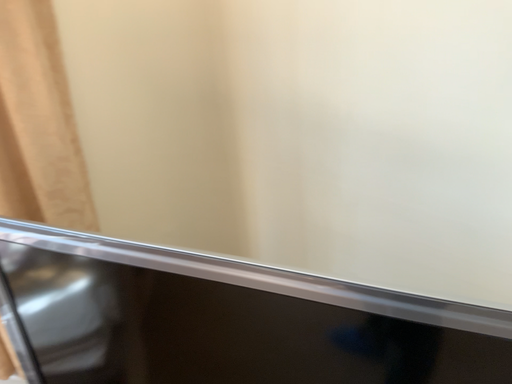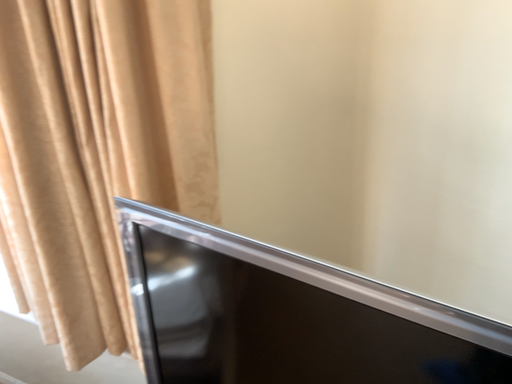
Question: How did the camera likely rotate when shooting the video?

Choices:
 (A) rotated right
 (B) rotated left

Answer: (B)